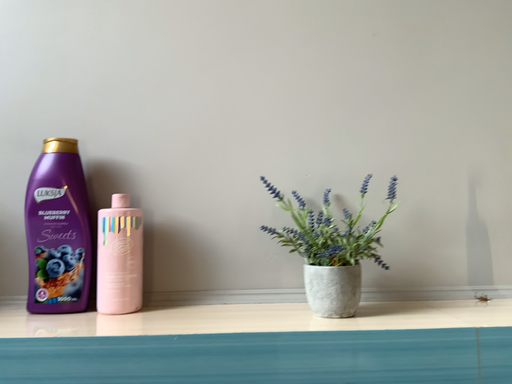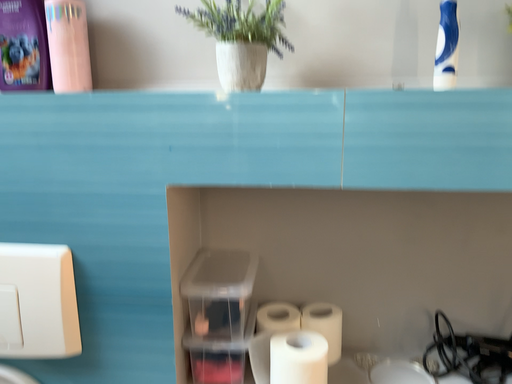
Question: Which way did the camera rotate in the video?

Choices:
 (A) rotated upward
 (B) rotated downward

Answer: (B)